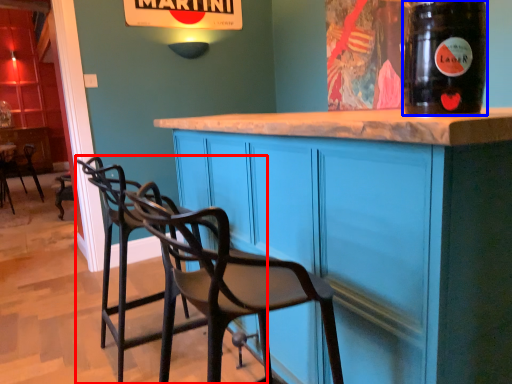
Question: Which object appears farthest to the camera in this image, chair (highlighted by a red box) or drinking straw (highlighted by a blue box)?

Choices:
 (A) chair
 (B) drinking straw

Answer: (A)